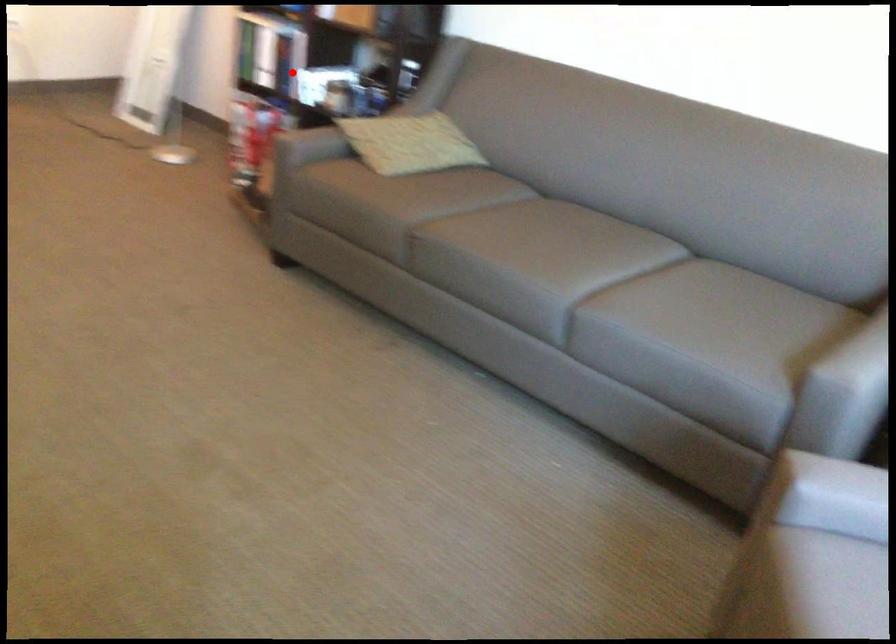
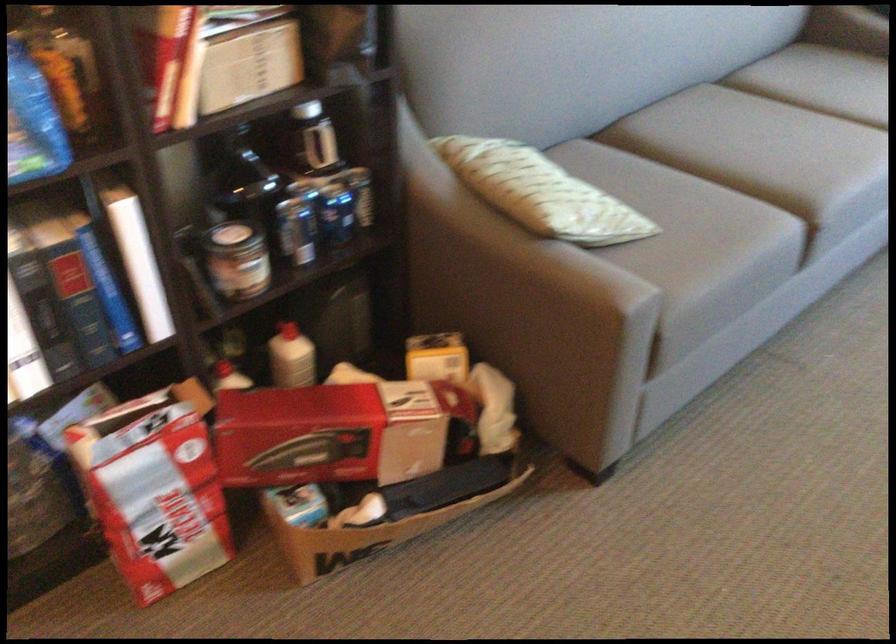
Question: I am providing you with two images of the same scene from different viewpoints. Given a red point in image1, look at the same physical point in image2. Is it:

Choices:
 (A) Closer to the viewpoint
 (B) Farther from the viewpoint

Answer: (A)